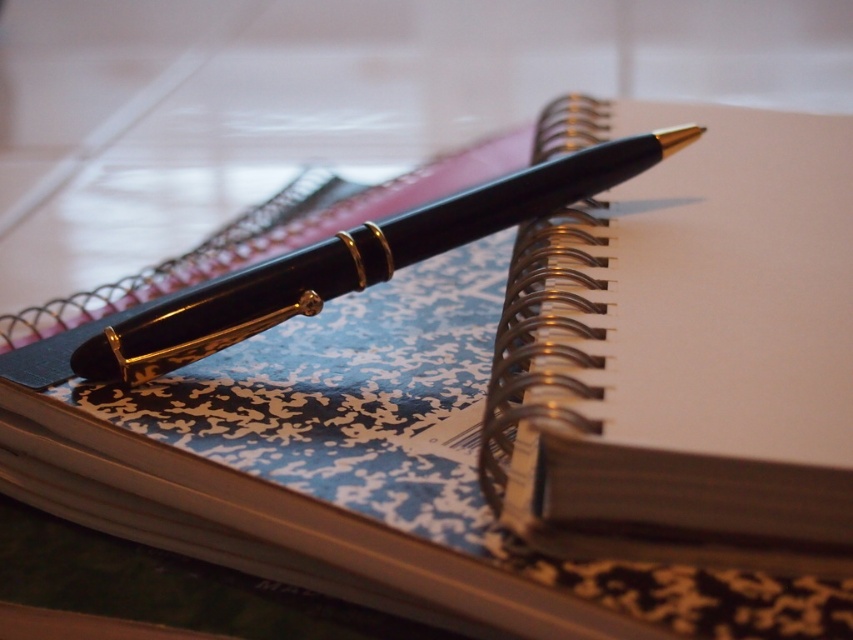
Between matte black notepad at upper right and matte black pen at center, which one appears on the right side from the viewer's perspective?

Positioned to the right is matte black notepad at upper right.

Does matte black notepad at upper right appear on the right side of matte black pen at center?

Indeed, matte black notepad at upper right is positioned on the right side of matte black pen at center.

Is point (585, 144) positioned in front of point (431, 236)?

No, (585, 144) is further to viewer.

Find the location of a particular element. matte black notepad at upper right is located at coordinates (683, 348).